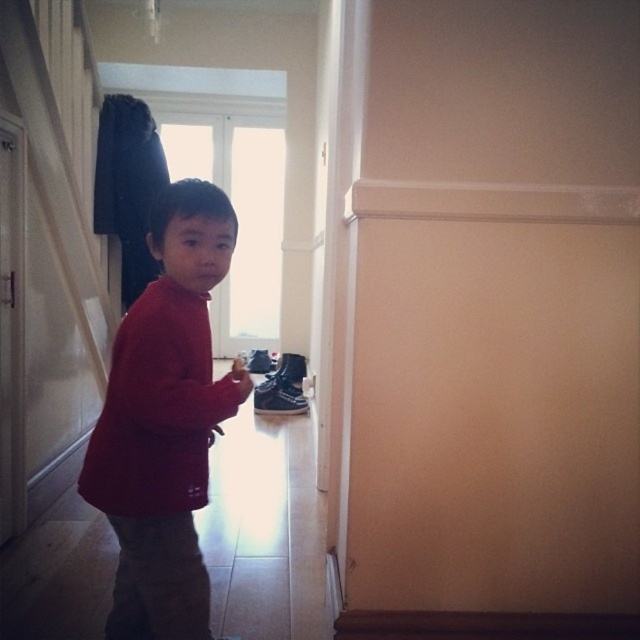
You are a parent looking for your child in a hallway. You see the red matte sweater at center and the black suede shoe at lower center. Which item is bigger?

The red matte sweater at center is larger in size than the black suede shoe at lower center.

You are a parent looking for your child in a hallway. You see the red matte sweater at center and the black suede shoe at lower center. Which object is closer to the white door at the end of the hallway?

The black suede shoe at lower center is closer to the white door at the end of the hallway because the red matte sweater at center is to the left of it, meaning the shoe is positioned further along the hallway towards the door.

You are a photographer trying to take a picture of the red matte sweater at center. The camera you are holding is 1.27 meters away from the sweater. Is the distance sufficient to capture the entire sweater in the frame?

The red matte sweater at center and camera are 1.27 meters apart. Whether this distance is sufficient depends on the camera lens and sensor size. However, since the question does not provide specifics about the camera equipment, it cannot be definitively answered with the given information.